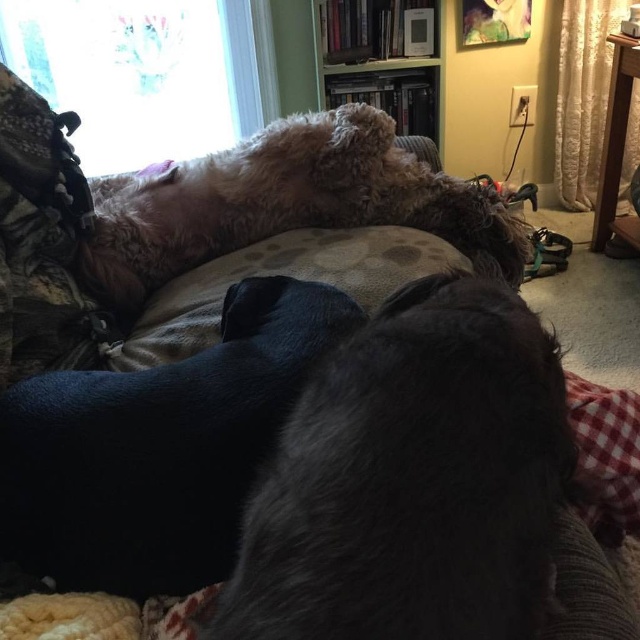
Question: Does dark fur dog at center come in front of clear glass window at upper left?

Choices:
 (A) yes
 (B) no

Answer: (A)

Question: Which of these objects is positioned closest to the fuzzy brown dog at upper center?

Choices:
 (A) wooden bookshelf at upper center
 (B) dark fur dog at center

Answer: (B)

Question: Observing the image, what is the correct spatial positioning of clear glass window at upper left in reference to wooden bookshelf at upper center?

Choices:
 (A) left
 (B) right

Answer: (A)

Question: Is dark fur dog at center above wooden bookshelf at upper center?

Choices:
 (A) yes
 (B) no

Answer: (B)

Question: Which of these objects is positioned closest to the fuzzy brown dog at upper center?

Choices:
 (A) shiny black fur at center
 (B) dark fur dog at center
 (C) clear glass window at upper left
 (D) wooden bookshelf at upper center

Answer: (A)

Question: Which object is positioned closest to the dark fur dog at center?

Choices:
 (A) clear glass window at upper left
 (B) wooden bookshelf at upper center

Answer: (B)